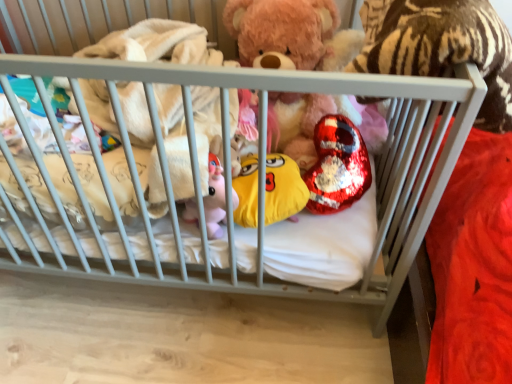
The width and height of the screenshot is (512, 384). Identify the location of unoccupied region to the right of yellow plush toy at center, the first toy when ordered from left to right. (341, 239).